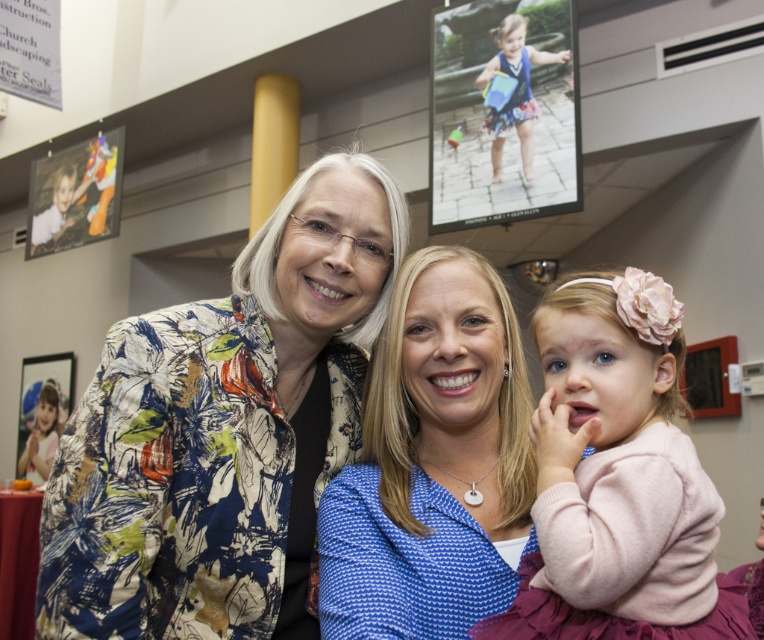
You are a fashion designer observing the scene. You notice the blue fabric dress at upper center and the pink fabric dress at lower right. Which dress is shorter in height?

The blue fabric dress at upper center is shorter in height than the pink fabric dress at lower right.